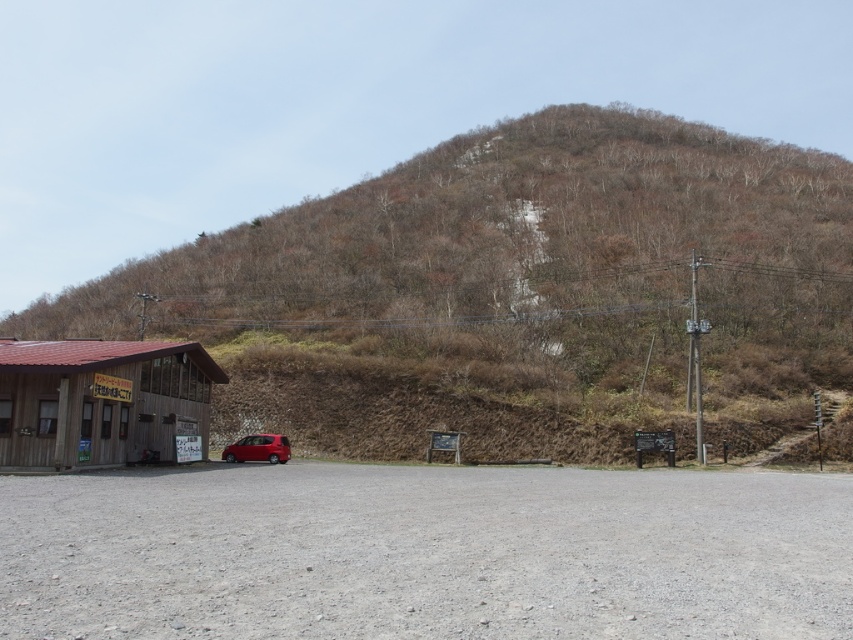
You are standing at the red car in front of the wooden building with a red roof. You want to walk to the point marked as point (270, 452). Is the point marked as point (636, 285) closer to you than the point you want to go to?

Point (636, 285) is further to the viewer than point (270, 452). So the point you want to go to is closer to you than point (636, 285).

You are standing at the point marked by point (102, 403) and want to walk towards the red car parked in front of the brown wooden hut at lower left. Is the path clear of obstacles?

The path is clear of obstacles because the scene description mentions a gravel surface where the red car is parked, and there are no objects listed in the provided information that would block the path between point (102, 403) and the red car.